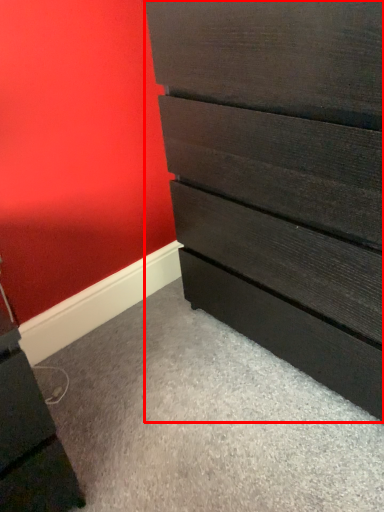
Question: Observing the image, what is the correct spatial positioning of chest of drawers (annotated by the red box) in reference to file cabinet?

Choices:
 (A) left
 (B) right

Answer: (B)